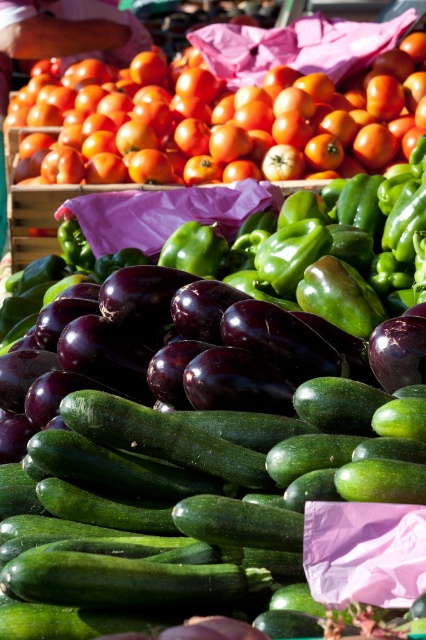
Does green smooth cucumber at center appear on the right side of shiny orange tomato at upper left?

Indeed, green smooth cucumber at center is positioned on the right side of shiny orange tomato at upper left.

Find the location of `green smooth cucumber at center`. green smooth cucumber at center is located at coordinates (196, 497).

The width and height of the screenshot is (426, 640). In order to click on green smooth cucumber at center in this screenshot , I will do `click(196, 497)`.